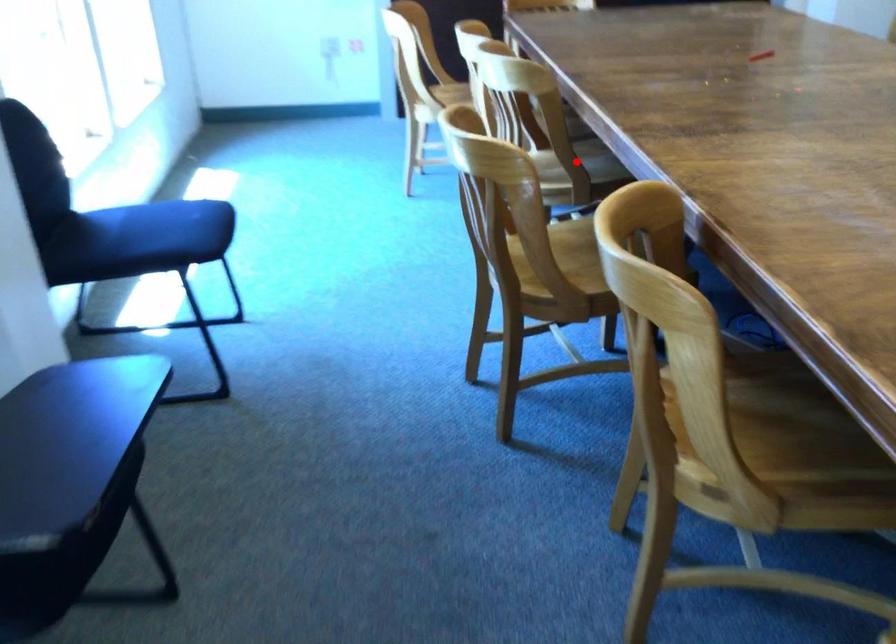
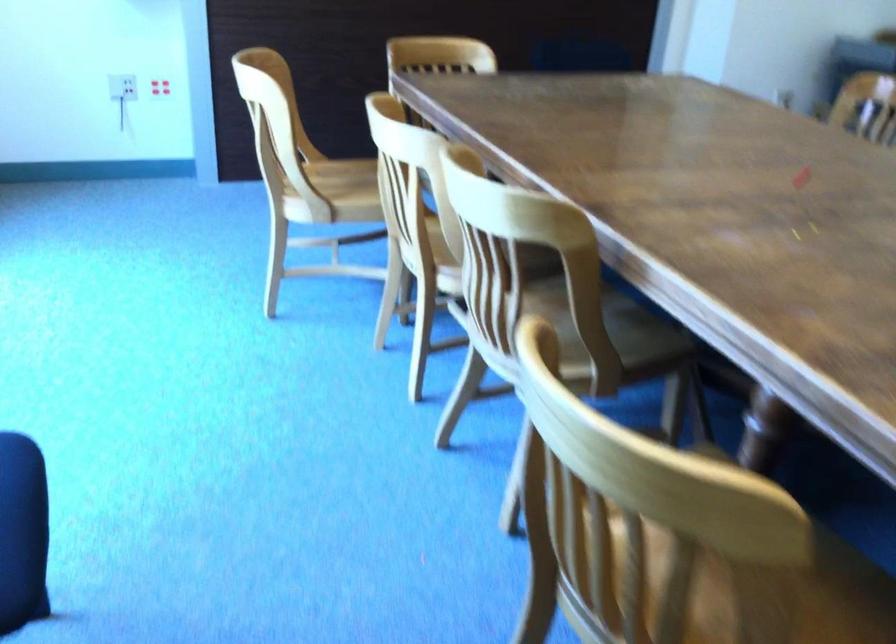
The point at the highlighted location is marked in the first image. Where is the corresponding point in the second image?

(615, 345)